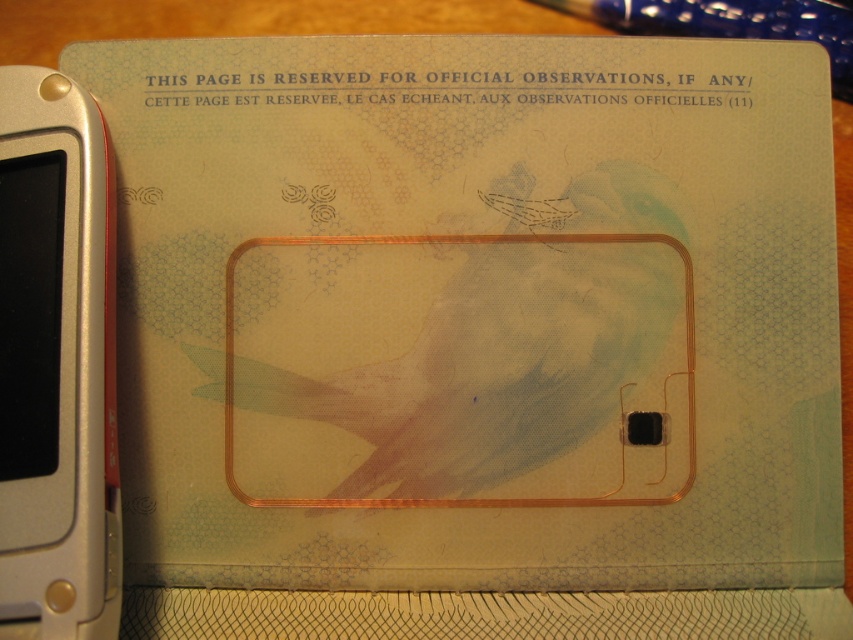
Question: Which object is farther from the camera taking this photo?

Choices:
 (A) silver metallic smartphone at left
 (B) transparent plastic pen at upper center

Answer: (B)

Question: Does silver metallic smartphone at left appear over transparent plastic pen at upper center?

Choices:
 (A) yes
 (B) no

Answer: (B)

Question: Which point is closer to the camera taking this photo?

Choices:
 (A) (91, 269)
 (B) (669, 29)

Answer: (A)

Question: Which object is farther from the camera taking this photo?

Choices:
 (A) transparent plastic pen at upper center
 (B) silver metallic smartphone at left

Answer: (A)

Question: Is silver metallic smartphone at left to the left of transparent plastic pen at upper center from the viewer's perspective?

Choices:
 (A) no
 (B) yes

Answer: (B)

Question: Is silver metallic smartphone at left wider than transparent plastic pen at upper center?

Choices:
 (A) yes
 (B) no

Answer: (B)